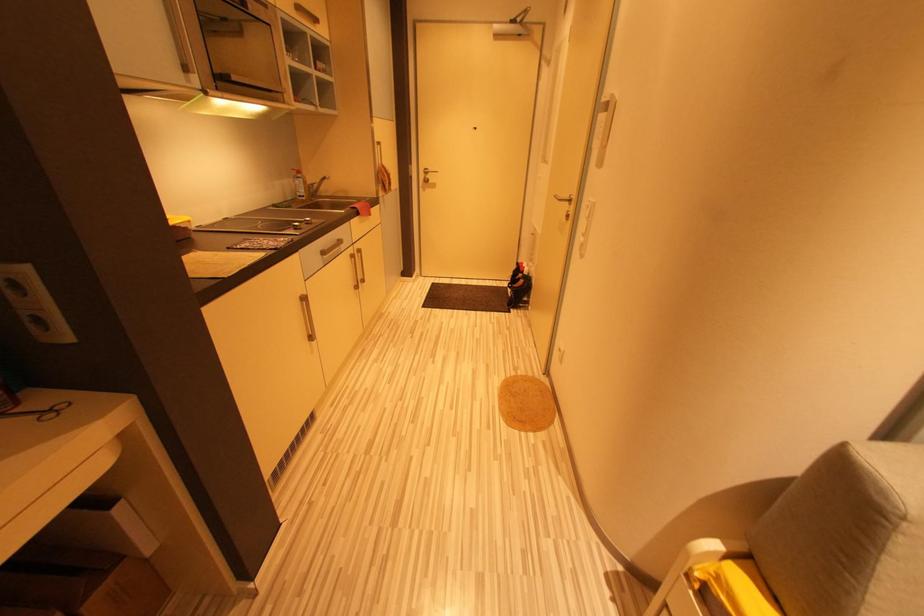
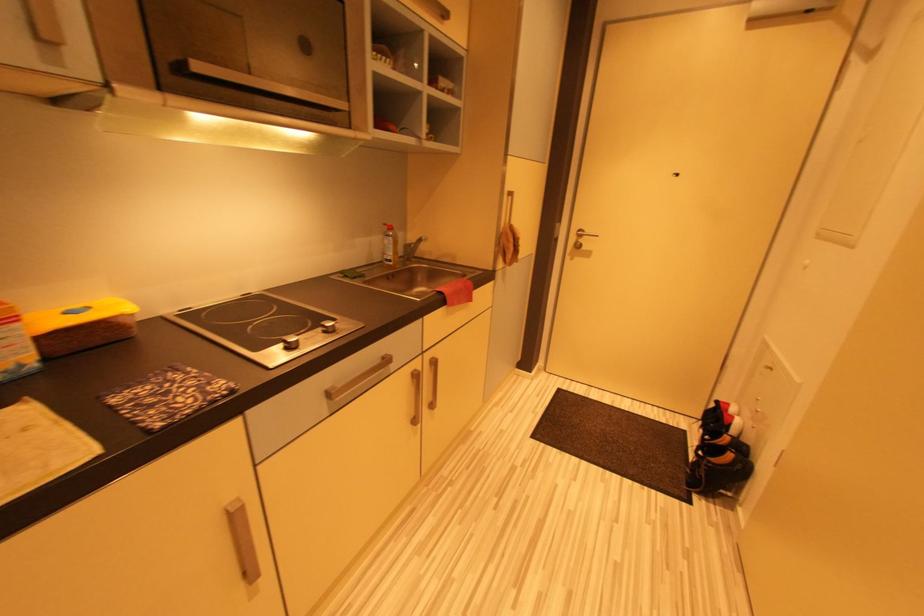
Question: The images are taken continuously from a first-person perspective. In which direction are you moving?

Choices:
 (A) Left
 (B) Right
 (C) Forward
 (D) Backward

Answer: (C)